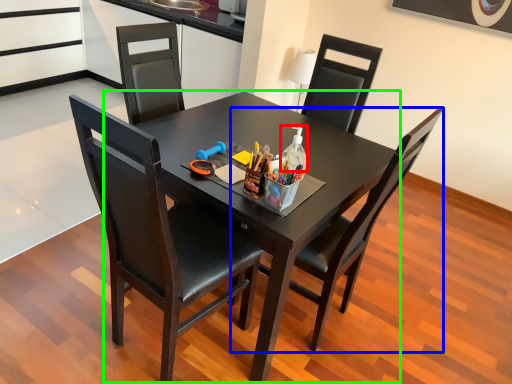
Question: Estimate the real-world distances between objects in this image. Which object is closer to bottle (highlighted by a red box), chair (highlighted by a blue box) or round table (highlighted by a green box)?

Choices:
 (A) chair
 (B) round table

Answer: (B)